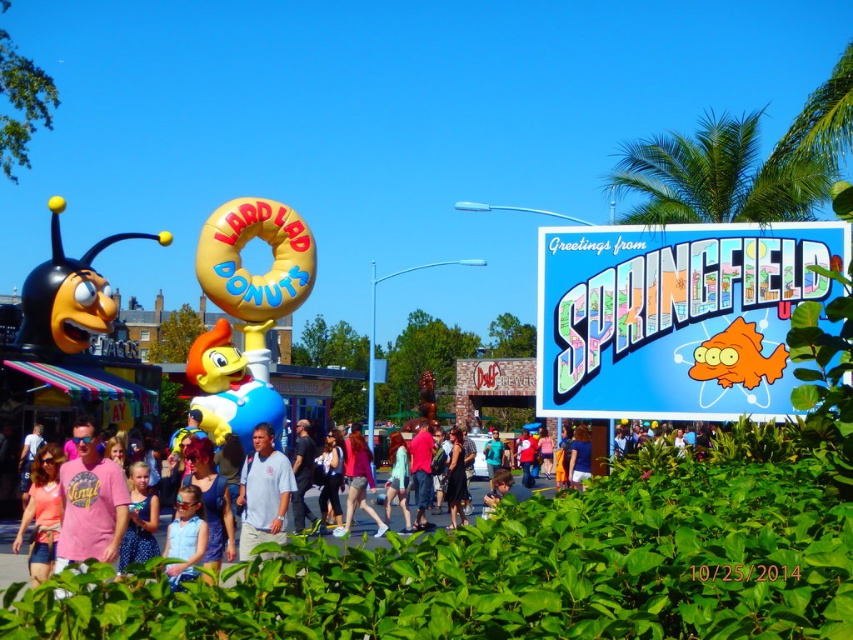
Can you confirm if blue plastic sign at upper right is positioned to the right of green leafy palm tree at upper right?

In fact, blue plastic sign at upper right is to the left of green leafy palm tree at upper right.

Measure the distance between blue plastic sign at upper right and green leafy palm tree at upper right.

42.70 meters

Image resolution: width=853 pixels, height=640 pixels. In order to click on blue plastic sign at upper right in this screenshot , I will do `click(675, 316)`.

Can you confirm if pink cotton shirt at lower left is positioned above blue fabric shirt at center?

Indeed, pink cotton shirt at lower left is positioned over blue fabric shirt at center.

The width and height of the screenshot is (853, 640). What do you see at coordinates (90, 502) in the screenshot?
I see `pink cotton shirt at lower left` at bounding box center [90, 502].

Find the location of a particular element. pink cotton shirt at lower left is located at coordinates (90, 502).

Describe the element at coordinates (717, 176) in the screenshot. Image resolution: width=853 pixels, height=640 pixels. I see `green leafy palm tree at upper right` at that location.

Which is behind, point (827, 172) or point (370, 515)?

Point (827, 172)

Find the location of a particular element. This screenshot has height=640, width=853. green leafy palm tree at upper right is located at coordinates (717, 176).